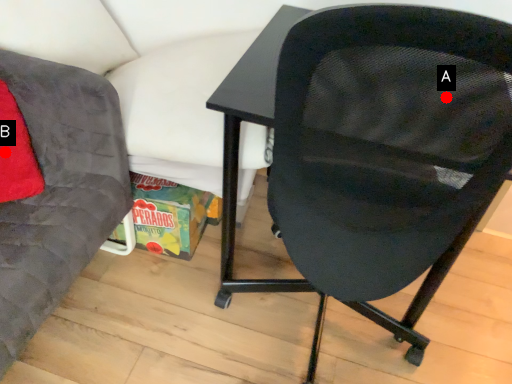
Question: Two points are circled on the image, labeled by A and B beside each circle. Which point is farther to the camera?

Choices:
 (A) A is further
 (B) B is further

Answer: (B)